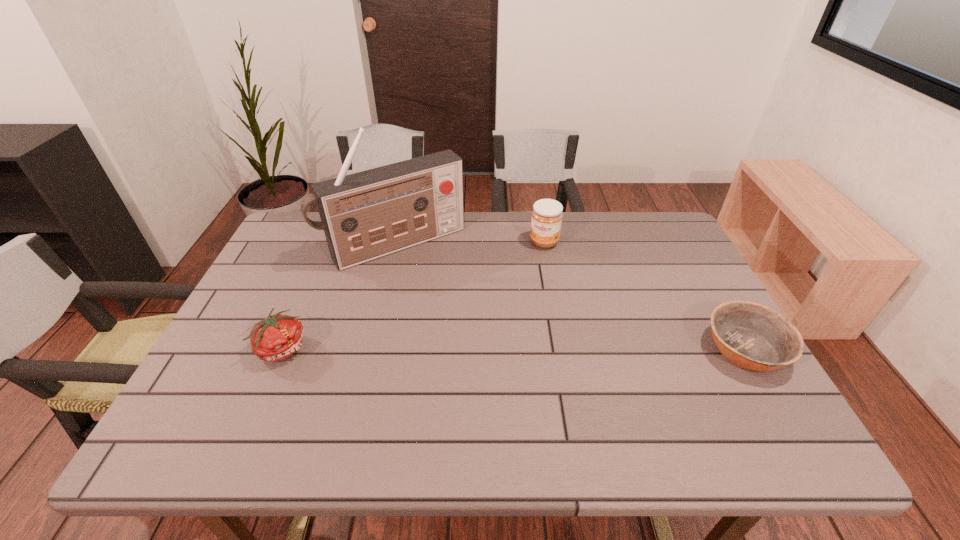
Find the location of `object at the far left corner`. object at the far left corner is located at coordinates (366, 215).

Locate an element on the screen. Image resolution: width=960 pixels, height=540 pixels. object that is at the near right corner is located at coordinates (754, 337).

Image resolution: width=960 pixels, height=540 pixels. In order to click on vacant space at the far edge of the desktop in this screenshot , I will do `click(516, 224)`.

Locate an element on the screen. This screenshot has width=960, height=540. vacant space at the near edge of the desktop is located at coordinates (354, 408).

I want to click on vacant space at the left edge, so click(x=259, y=291).

The width and height of the screenshot is (960, 540). I want to click on free region at the right edge of the desktop, so click(x=671, y=284).

The image size is (960, 540). I want to click on free space at the far left corner of the desktop, so click(x=283, y=248).

The image size is (960, 540). I want to click on vacant space at the near left corner of the desktop, so click(248, 381).

The width and height of the screenshot is (960, 540). In order to click on vacant space at the far right corner in this screenshot , I will do `click(665, 241)`.

At what (x,y) coordinates should I click in order to perform the action: click on empty space that is in between the tomato and the radio receiver. Please return your answer as a coordinate pair (x, y). Image resolution: width=960 pixels, height=540 pixels. Looking at the image, I should click on (339, 296).